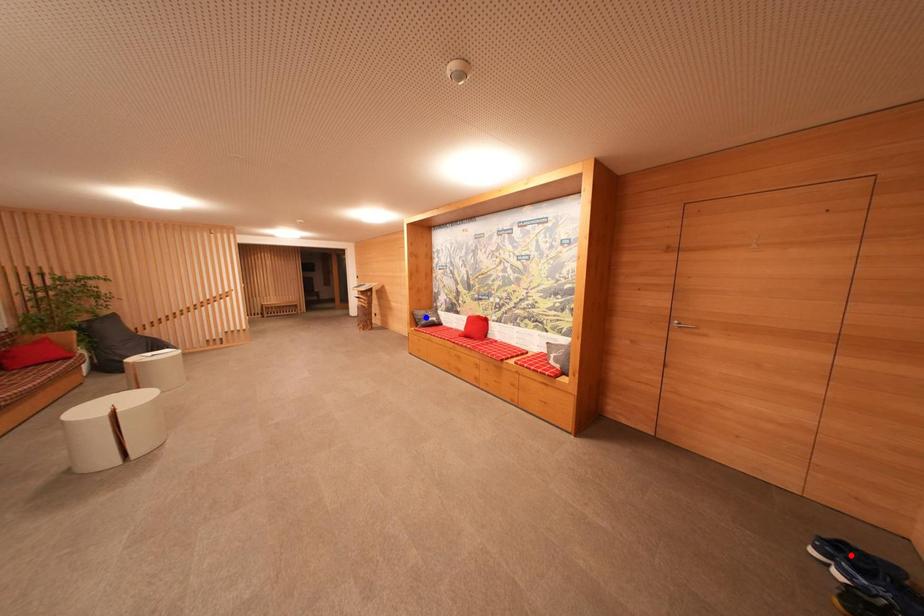
Question: In the image, two points are highlighted. Which point is nearer to the camera? Reply with the corresponding letter.

Choices:
 (A) blue point
 (B) red point

Answer: (B)